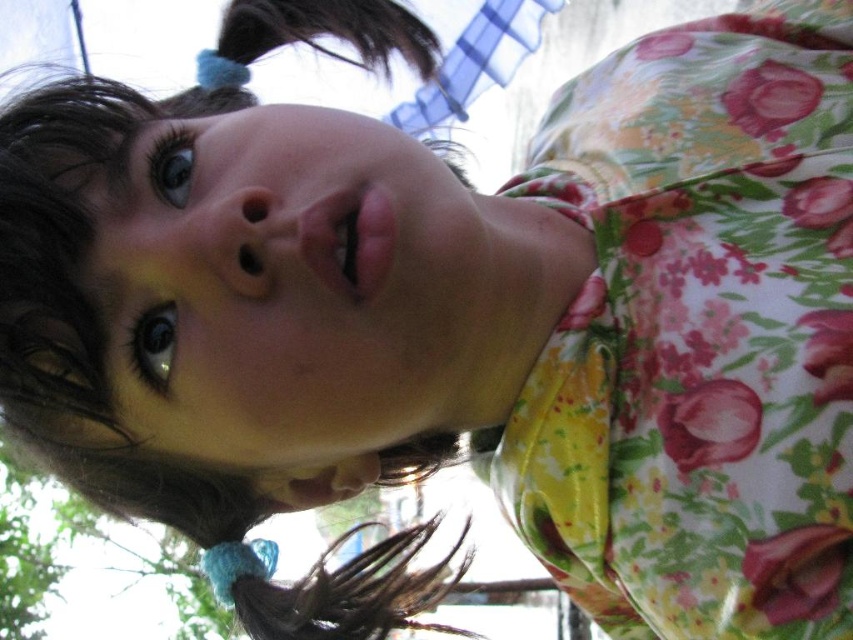
Question: Which of the following is the closest to the observer?

Choices:
 (A) floral fabric dress at upper center
 (B) blue fabric hair at upper center

Answer: (A)

Question: Is floral fabric dress at upper center behind blue fabric hair at upper center?

Choices:
 (A) yes
 (B) no

Answer: (B)

Question: Which point appears farthest from the camera in this image?

Choices:
 (A) (653, 531)
 (B) (352, 64)

Answer: (B)

Question: Does floral fabric dress at upper center have a smaller size compared to blue fabric hair at upper center?

Choices:
 (A) yes
 (B) no

Answer: (B)

Question: Among these points, which one is nearest to the camera?

Choices:
 (A) (769, 618)
 (B) (210, 74)

Answer: (A)

Question: Can you confirm if floral fabric dress at upper center is thinner than blue fabric hair at upper center?

Choices:
 (A) yes
 (B) no

Answer: (B)